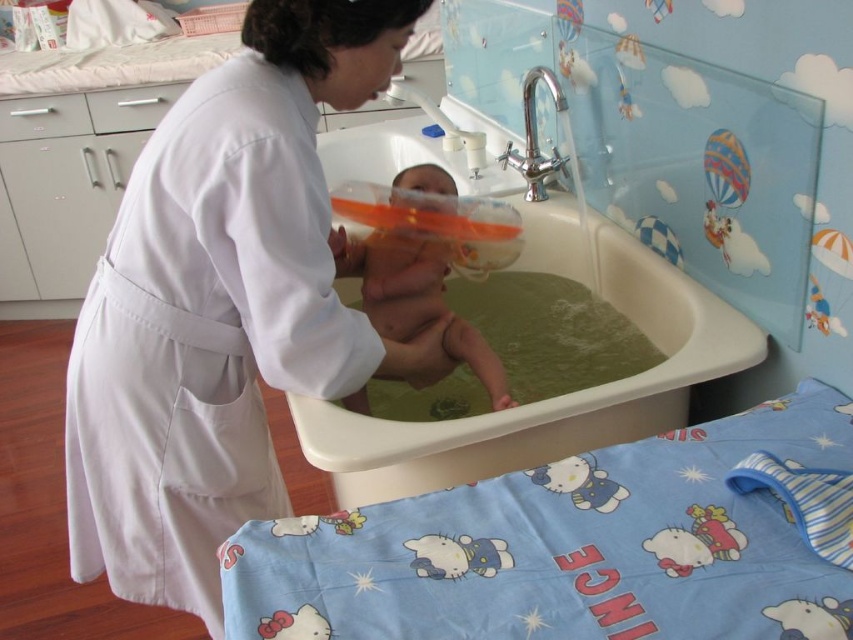
You are a photographer trying to capture the exact location of the white matte uniform at center in this scene. According to the coordinates provided, where would you position your camera to ensure the uniform is centered in the frame?

The white matte uniform at center is located at coordinates point [224,305], so positioning the camera to center the frame at that point would capture the uniform accurately.

You are a caregiver who needs to place a green plastic bath at center in the scene. Where should you put it?

The green plastic bath at center should be placed at point (552,397).